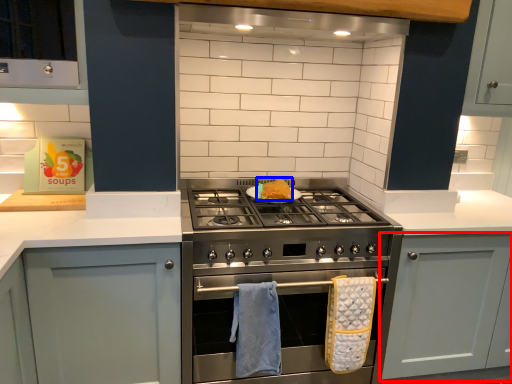
Question: Which object appears closest to the camera in this image, cabinetry (highlighted by a red box) or food (highlighted by a blue box)?

Choices:
 (A) cabinetry
 (B) food

Answer: (A)